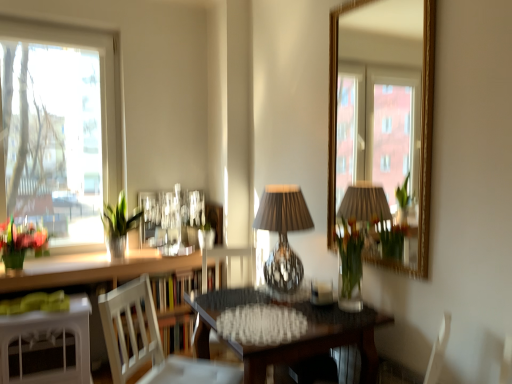
Question: Does shiny glass table lamp at center turn towards translucent glass vase at center?

Choices:
 (A) no
 (B) yes

Answer: (A)

Question: From the image's perspective, is shiny glass table lamp at center located above translucent glass vase at center?

Choices:
 (A) no
 (B) yes

Answer: (B)

Question: Could translucent glass vase at center be considered to be inside shiny glass table lamp at center?

Choices:
 (A) no
 (B) yes

Answer: (A)

Question: Can you confirm if shiny glass table lamp at center is positioned to the right of translucent glass vase at center?

Choices:
 (A) no
 (B) yes

Answer: (A)

Question: Is shiny glass table lamp at center not close to translucent glass vase at center?

Choices:
 (A) no
 (B) yes

Answer: (A)

Question: Is shiny glass table lamp at center smaller than translucent glass vase at center?

Choices:
 (A) yes
 (B) no

Answer: (B)

Question: Is clear glass window at left at the left side of shiny glass table lamp at center?

Choices:
 (A) yes
 (B) no

Answer: (A)

Question: Is clear glass window at left in front of shiny glass table lamp at center?

Choices:
 (A) no
 (B) yes

Answer: (A)

Question: From a real-world perspective, is clear glass window at left physically above shiny glass table lamp at center?

Choices:
 (A) yes
 (B) no

Answer: (A)

Question: Is clear glass window at left not inside shiny glass table lamp at center?

Choices:
 (A) no
 (B) yes

Answer: (B)

Question: Does clear glass window at left contain shiny glass table lamp at center?

Choices:
 (A) no
 (B) yes

Answer: (A)

Question: Is clear glass window at left bigger than shiny glass table lamp at center?

Choices:
 (A) no
 (B) yes

Answer: (B)

Question: Can we say green glass vase at left lies outside translucent glass vase at center?

Choices:
 (A) no
 (B) yes

Answer: (B)